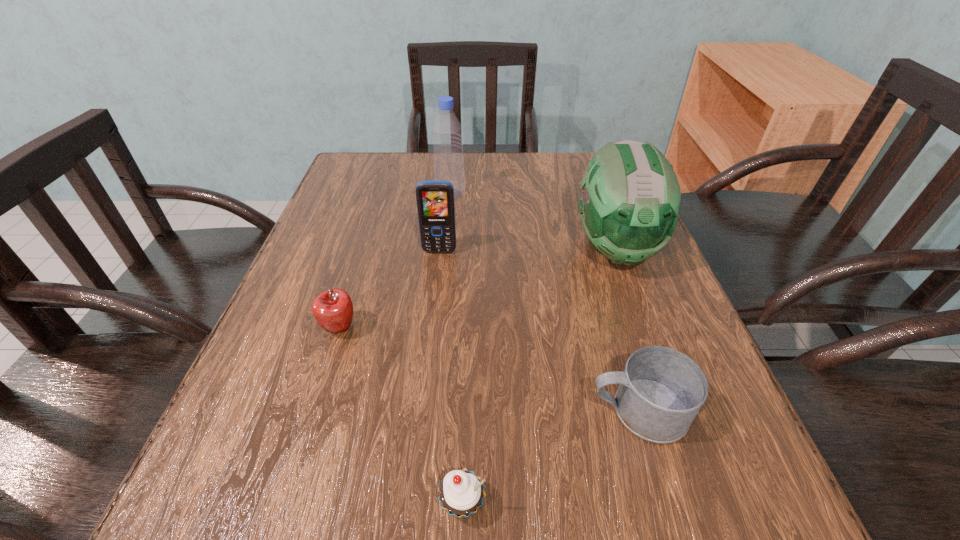
Image resolution: width=960 pixels, height=540 pixels. I want to click on the farthest object, so click(x=447, y=132).

This screenshot has height=540, width=960. In order to click on football helmet in this screenshot , I will do `click(630, 202)`.

At what (x,y) coordinates should I click in order to perform the action: click on cellular telephone. Please return your answer as a coordinate pair (x, y). Looking at the image, I should click on (435, 201).

Identify the location of the fourth farthest object. The height and width of the screenshot is (540, 960). (333, 309).

Where is `the leftmost object`? The image size is (960, 540). the leftmost object is located at coordinates (333, 309).

What are the coordinates of `the fifth farthest object` in the screenshot? It's located at (661, 390).

The width and height of the screenshot is (960, 540). Identify the location of the nearest object. (461, 492).

Locate an element on the screen. vacant region located on the left of the bottle is located at coordinates (383, 194).

You are a GUI agent. You are given a task and a screenshot of the screen. Output one action in this format:
    pyautogui.click(x=<x>, y=<y>)
    Task: Click on the free spot located on the visor of the football helmet
    The height and width of the screenshot is (540, 960).
    Given the screenshot: What is the action you would take?
    pyautogui.click(x=686, y=441)

At what (x,y) coordinates should I click in order to perform the action: click on vacant area situated 0.240m on the screen of the cellular telephone. Please return your answer as a coordinate pair (x, y). The width and height of the screenshot is (960, 540). Looking at the image, I should click on (429, 345).